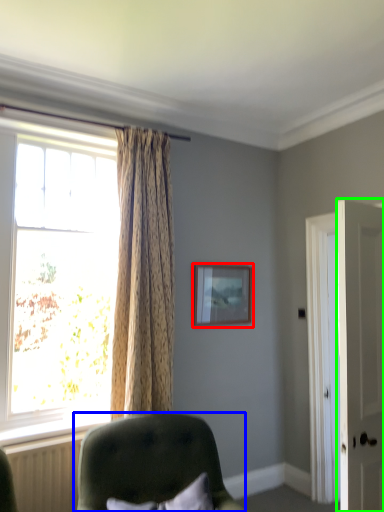
Question: Which object is the farthest from picture frame (highlighted by a red box)? Choose among these: chair (highlighted by a blue box) or door (highlighted by a green box).

Choices:
 (A) chair
 (B) door

Answer: (B)